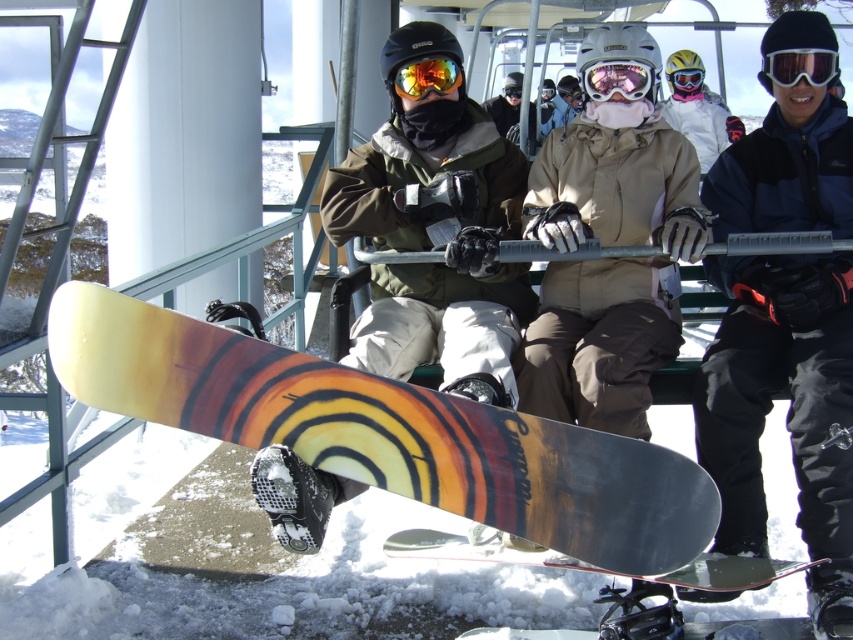
You are a photographer trying to capture a closeup shot of both the matte black goggles at upper right and the shiny orange reflective goggles at center. Given that your camera can focus on objects within a 1.5 meter range, will you be able to include both in the same frame without moving the camera?

The distance between the matte black goggles at upper right and the shiny orange reflective goggles at center is 1.65 meters. Since your camera can only focus within 1.5 meters, you won the be able to capture both in the same frame without moving the camera.

You are a photographer trying to capture a closeup shot of the snowboarder in the foreground. You have two markers labeled point A at point (64, 364) and point B at point (440, 77). Which point should you focus on to ensure the snowboarder is in focus?

Point A at point (64, 364) is closer to the camera than point B at point (440, 77), so you should focus on point A to ensure the snowboarder in the foreground is in focus.

You are a photographer taking a photo of the yellow matte snowboard at center and the shiny orange reflective goggles at center. Which object should you focus on first if you want to capture both in focus, considering their sizes?

The yellow matte snowboard at center is much taller than the shiny orange reflective goggles at center, so you should focus on the yellow matte snowboard at center first to ensure both are in focus.